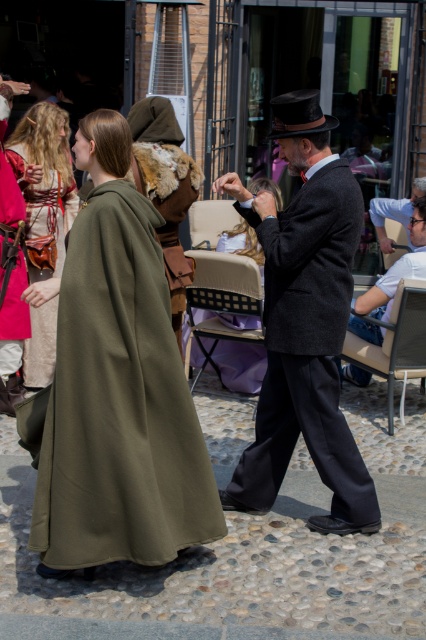
You are organizing a costume fitting session and need to determine which costume requires more fabric. Based on the scene, which object, the dark gray wool suit at center or the matte green cloak at left, would need more fabric for its construction?

The dark gray wool suit at center is bigger than the matte green cloak at left, so it would require more fabric for its construction.

You are an event organizer at the historical reenactment. You need to ensure that the olive woolen cape at center and the smooth gray suit at center are displayed properly. Which of the two requires a larger display space due to its size?

The olive woolen cape at center requires a larger display space because it is larger in size than the smooth gray suit at center.

You are a photographer at the event and need to capture a photo where both the matte green cloak at left and the smooth gray suit at center are clearly visible. Given their height difference, which object might appear larger in the photo?

The matte green cloak at left appears larger in the photo because it is much taller than the smooth gray suit at center.